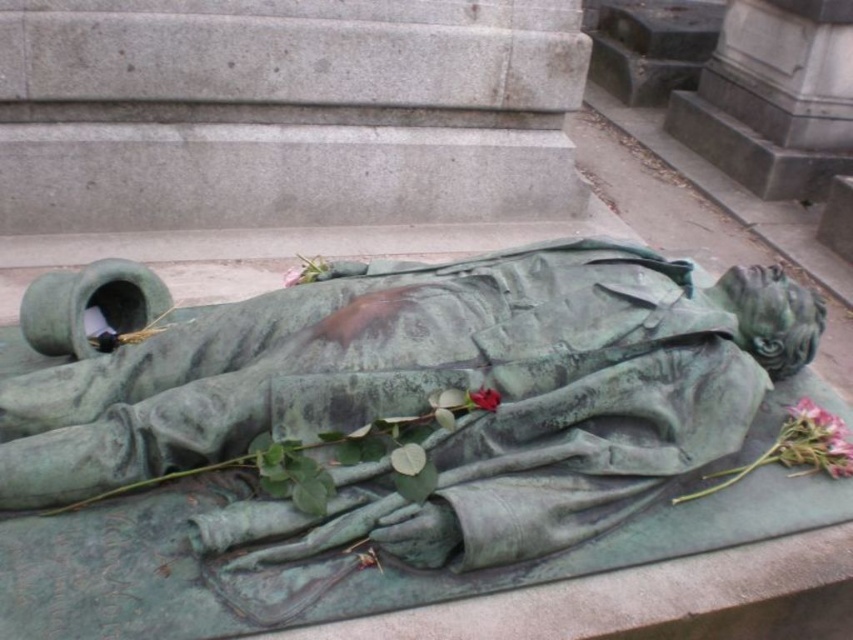
You are standing in front of the green patina statue at center. You want to place a wreath on it, but you are only 5 feet tall. Can you reach the top of the statue without any assistance?

The green patina statue at center is 4.19 feet from viewer. Since you are 5 feet tall, you can reach the top of the statue without needing assistance.

You are a florist arranging flowers for a memorial service. You have two roses available in the scene, the pink matte rose at lower right and the matte green rose at center. Which rose should you choose if you need a larger flower for a centerpiece?

The pink matte rose at lower right is bigger than the matte green rose at center, so you should choose the pink matte rose at lower right for the centerpiece.

You are a photographer trying to capture the statue and the roses in a single frame. The camera is positioned so that the point at coordinates point (428, 397) is exactly at the center of the viewfinder. Where should you look for the roses in relation to this central point?

The roses are not mentioned in the objects description, so their exact position relative to the statue cannot be determined. However, based on the scene description, they are placed near the statue, likely around the base or nearby area. To capture both in the frame, adjust the camera angle to include the area around the statue where the roses are situated.